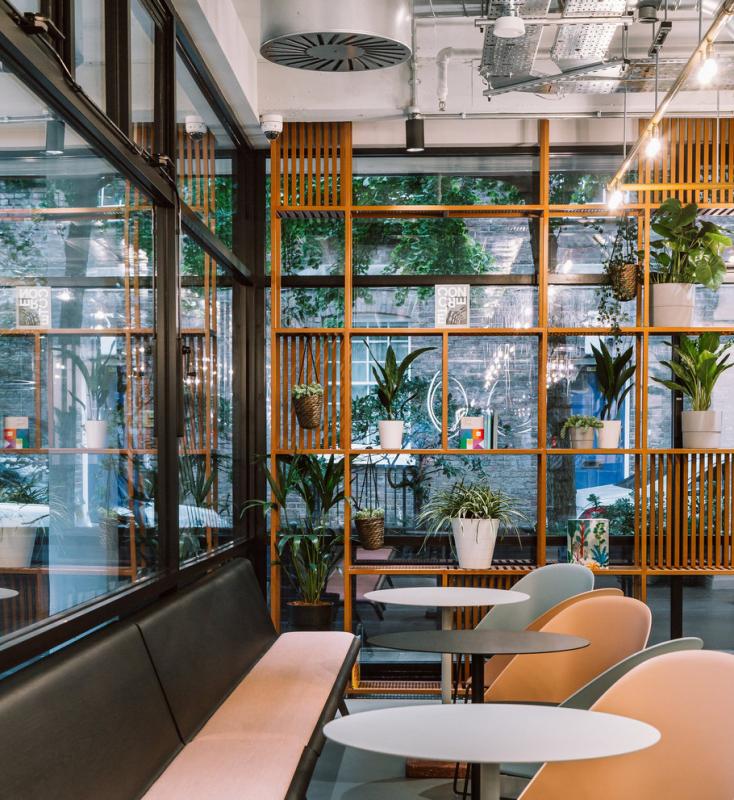
Find the location of a particular element. overhead lights is located at coordinates (711, 69), (705, 81), (655, 148), (650, 156), (616, 198), (611, 205).